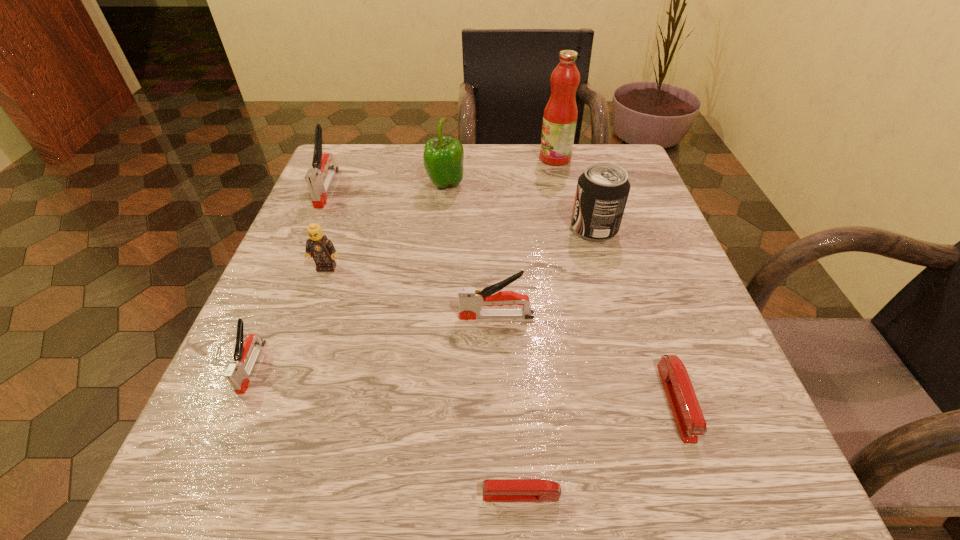
Identify the location of vacant region located 0.070m on the front-facing side of the nearest object. (423, 495).

Where is `vacant space located 0.190m on the front-facing side of the nearest object`? The image size is (960, 540). vacant space located 0.190m on the front-facing side of the nearest object is located at coordinates (322, 495).

In order to click on fruit juice that is at the far edge in this screenshot , I will do `click(560, 115)`.

Identify the location of bell pepper located in the far edge section of the desktop. This screenshot has height=540, width=960. (443, 157).

You are a GUI agent. You are given a task and a screenshot of the screen. Output one action in this format:
    pyautogui.click(x=<x>, y=<y>)
    Task: Click on the stapler situated at the far edge
    The height and width of the screenshot is (540, 960).
    Given the screenshot: What is the action you would take?
    pyautogui.click(x=319, y=190)

Identify the location of Lego positioned at the left edge. The width and height of the screenshot is (960, 540). (319, 247).

Identify the location of fruit juice positioned at the right edge. The image size is (960, 540). (560, 115).

Locate an element on the screen. This screenshot has height=540, width=960. soda can that is at the right edge is located at coordinates (602, 191).

This screenshot has width=960, height=540. In order to click on stapler that is positioned at the right edge in this screenshot , I will do `click(690, 421)`.

In order to click on object that is at the far left corner in this screenshot , I will do `click(319, 190)`.